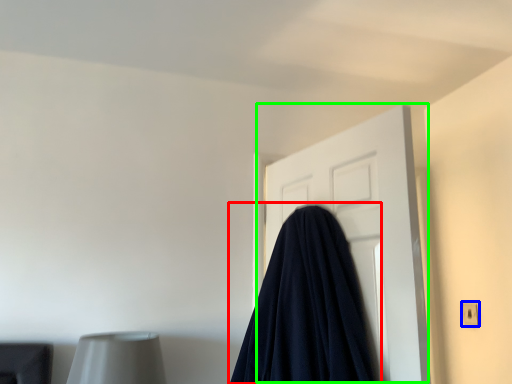
Question: Considering the real-world distances, which object is farthest from blanket (highlighted by a red box)? electric outlet (highlighted by a blue box) or door (highlighted by a green box)?

Choices:
 (A) electric outlet
 (B) door

Answer: (A)